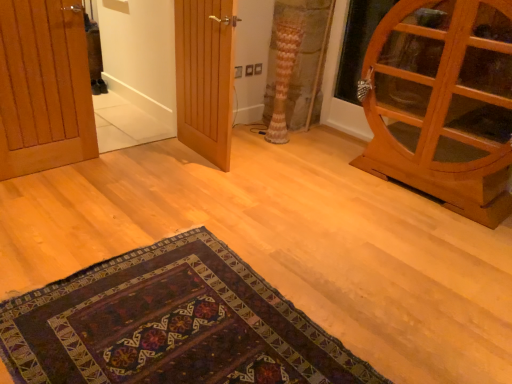
Question: From the image's perspective, would you say wooden door at left, placed as the third door when sorted from right to left, is shown under wooden door at center, the second door in the right-to-left sequence?

Choices:
 (A) yes
 (B) no

Answer: (A)

Question: Does wooden door at left, placed as the third door when sorted from right to left, have a smaller size compared to wooden door at center, the second door in the right-to-left sequence?

Choices:
 (A) no
 (B) yes

Answer: (B)

Question: Is wooden door at left, the 1th door from the left, positioned behind wooden door at center, the 2th door when ordered from left to right?

Choices:
 (A) yes
 (B) no

Answer: (B)

Question: From a real-world perspective, is wooden door at left, placed as the third door when sorted from right to left, on wooden door at center, the second door in the right-to-left sequence?

Choices:
 (A) no
 (B) yes

Answer: (A)

Question: Considering the relative sizes of wooden door at left, the 1th door from the left, and wooden door at center, the second door in the right-to-left sequence, in the image provided, is wooden door at left, the 1th door from the left, thinner than wooden door at center, the second door in the right-to-left sequence,?

Choices:
 (A) yes
 (B) no

Answer: (A)

Question: Considering the relative sizes of wooden door at left, the 1th door from the left, and wooden door at center, the second door in the right-to-left sequence, in the image provided, is wooden door at left, the 1th door from the left, wider than wooden door at center, the second door in the right-to-left sequence,?

Choices:
 (A) yes
 (B) no

Answer: (B)

Question: Is wooden door at center, the second door in the right-to-left sequence, far from patterned fabric curtain at center?

Choices:
 (A) yes
 (B) no

Answer: (B)

Question: Does wooden door at center, the second door in the right-to-left sequence, have a smaller size compared to patterned fabric curtain at center?

Choices:
 (A) no
 (B) yes

Answer: (A)

Question: Is wooden door at center, the 2th door when ordered from left to right, taller than patterned fabric curtain at center?

Choices:
 (A) yes
 (B) no

Answer: (A)

Question: Is patterned fabric curtain at center at the back of wooden door at center, the second door in the right-to-left sequence?

Choices:
 (A) no
 (B) yes

Answer: (B)

Question: Is wooden door at center, the second door in the right-to-left sequence, at the left side of patterned fabric curtain at center?

Choices:
 (A) no
 (B) yes

Answer: (B)

Question: From the image's perspective, does wooden door at center, the second door in the right-to-left sequence, appear lower than patterned fabric curtain at center?

Choices:
 (A) no
 (B) yes

Answer: (B)

Question: Is wooden cabinet at right, which is counted as the 3th door, starting from the left, positioned in front of wooden door at center, the second door in the right-to-left sequence?

Choices:
 (A) yes
 (B) no

Answer: (A)